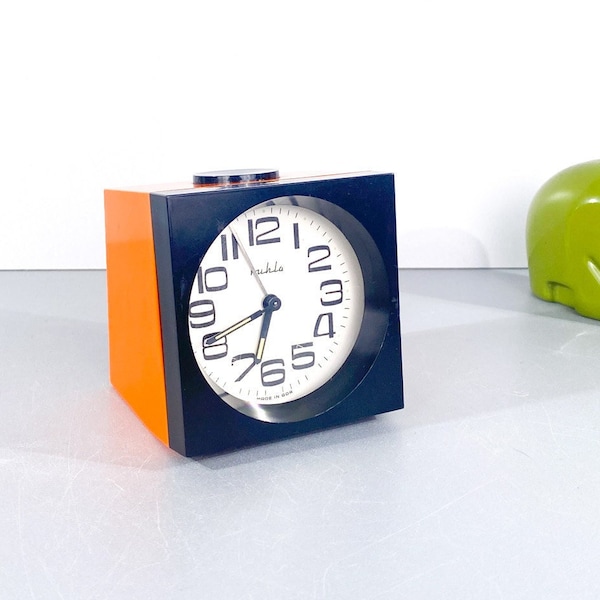
Where is `table`? table is located at coordinates (499, 492).